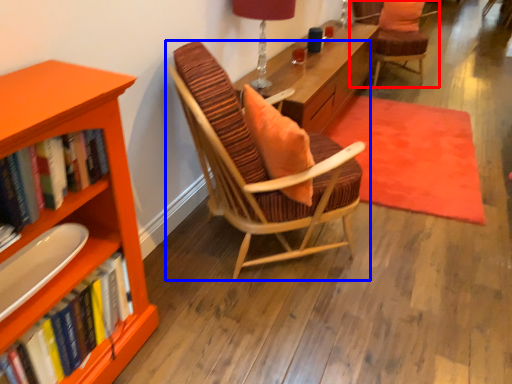
Question: Which point is closer to the camera, chair (highlighted by a red box) or chair (highlighted by a blue box)?

Choices:
 (A) chair
 (B) chair

Answer: (B)